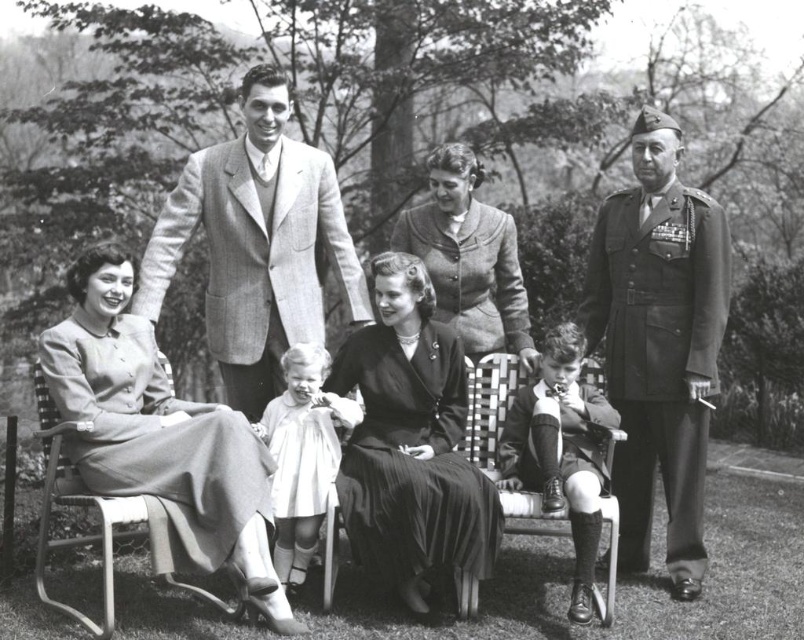
Between uniformed military officer at right and matte gray dress at center, which one is positioned lower?

Positioned lower is uniformed military officer at right.

Is uniformed military officer at right thinner than matte gray dress at center?

Correct, uniformed military officer at right's width is less than matte gray dress at center's.

Who is more distant from viewer, (626, 378) or (452, 225)?

The point (452, 225) is behind.

Where is `uniformed military officer at right`? The image size is (804, 640). uniformed military officer at right is located at coordinates (659, 342).

Consider the image. Is smooth wool suit at center positioned in front of smooth woolen suit at lower center?

No, it is behind smooth woolen suit at lower center.

Between smooth wool suit at center and smooth woolen suit at lower center, which one has more height?

smooth wool suit at center is taller.

The height and width of the screenshot is (640, 804). I want to click on smooth wool suit at center, so click(x=256, y=243).

Who is more forward, (384, 532) or (515, 451)?

Point (384, 532)

Is matte black dress at center closer to camera compared to smooth woolen suit at lower center?

No.

Is point (371, 404) farther from camera compared to point (503, 461)?

No, (371, 404) is in front of (503, 461).

Image resolution: width=804 pixels, height=640 pixels. I want to click on matte black dress at center, so click(x=412, y=445).